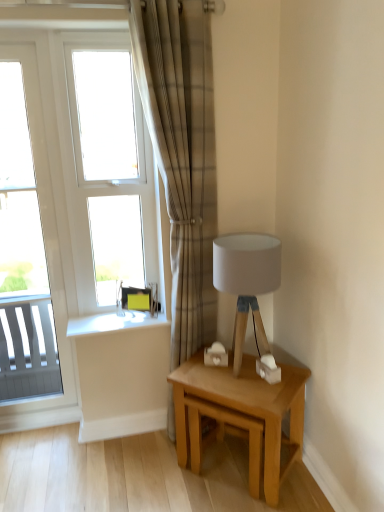
Question: Considering the relative positions of plaid fabric curtain at center and white glossy window at left, which is the second window in right-to-left order, in the image provided, is plaid fabric curtain at center in front of white glossy window at left, which is the second window in right-to-left order,?

Choices:
 (A) no
 (B) yes

Answer: (B)

Question: Does plaid fabric curtain at center appear on the right side of white glossy window at left, acting as the 1th window starting from the left?

Choices:
 (A) no
 (B) yes

Answer: (B)

Question: Is plaid fabric curtain at center far from white glossy window at left, which is the second window in right-to-left order?

Choices:
 (A) no
 (B) yes

Answer: (A)

Question: From a real-world perspective, does plaid fabric curtain at center sit lower than white glossy window at left, acting as the 1th window starting from the left?

Choices:
 (A) no
 (B) yes

Answer: (A)

Question: From a real-world perspective, is plaid fabric curtain at center on white glossy window at left, which is the second window in right-to-left order?

Choices:
 (A) yes
 (B) no

Answer: (A)

Question: Considering their positions, is light oak wooden table at lower right located in front of or behind white glass window at upper left, the second window when ordered from left to right?

Choices:
 (A) behind
 (B) front

Answer: (B)

Question: In terms of height, does light oak wooden table at lower right look taller or shorter compared to white glass window at upper left, the second window when ordered from left to right?

Choices:
 (A) short
 (B) tall

Answer: (A)

Question: Does point (248, 354) appear closer or farther from the camera than point (102, 124)?

Choices:
 (A) closer
 (B) farther

Answer: (A)

Question: Is light oak wooden table at lower right wider or thinner than white glass window at upper left, the second window when ordered from left to right?

Choices:
 (A) thin
 (B) wide

Answer: (B)

Question: In the image, is light oak wooden table at lower right positioned in front of or behind white glossy window at left, which is the second window in right-to-left order?

Choices:
 (A) front
 (B) behind

Answer: (A)

Question: From the image's perspective, is light oak wooden table at lower right positioned above or below white glossy window at left, which is the second window in right-to-left order?

Choices:
 (A) above
 (B) below

Answer: (B)

Question: Visually, is light oak wooden table at lower right positioned to the left or to the right of white glossy window at left, acting as the 1th window starting from the left?

Choices:
 (A) right
 (B) left

Answer: (A)

Question: Looking at their shapes, would you say light oak wooden table at lower right is wider or thinner than white glossy window at left, acting as the 1th window starting from the left?

Choices:
 (A) wide
 (B) thin

Answer: (A)

Question: Considering the positions of white glass window at upper left, which is the 1th window in right-to-left order, and plaid fabric curtain at center in the image, is white glass window at upper left, which is the 1th window in right-to-left order, taller or shorter than plaid fabric curtain at center?

Choices:
 (A) short
 (B) tall

Answer: (A)

Question: Which is correct: white glass window at upper left, which is the 1th window in right-to-left order, is inside plaid fabric curtain at center, or outside of it?

Choices:
 (A) outside
 (B) inside

Answer: (A)